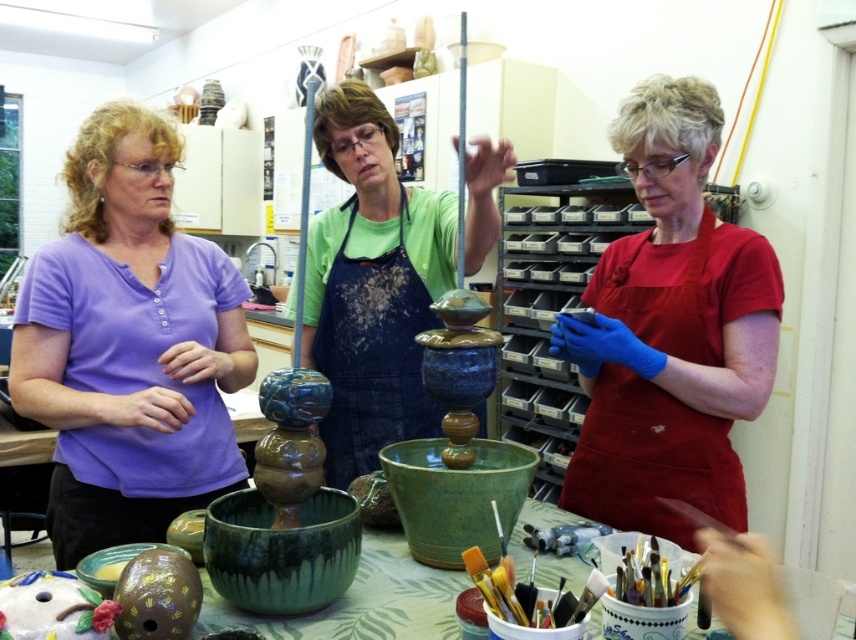
Question: Is purple cotton shirt at left above blue glossy vase at center?

Choices:
 (A) no
 (B) yes

Answer: (A)

Question: Which object is farther from the camera taking this photo?

Choices:
 (A) blue denim apron at center
 (B) purple cotton shirt at left
 (C) red matte apron at center
 (D) blue glossy vase at center

Answer: (A)

Question: Where is purple cotton shirt at left located in relation to blue glossy vase at center in the image?

Choices:
 (A) left
 (B) right

Answer: (A)

Question: Which point appears farthest from the camera in this image?

Choices:
 (A) (437, 323)
 (B) (450, 220)
 (C) (643, 440)

Answer: (A)

Question: Which of these objects is positioned farthest from the blue glossy vase at center?

Choices:
 (A) purple cotton shirt at left
 (B) blue denim apron at center
 (C) red matte apron at center

Answer: (C)

Question: Does purple cotton shirt at left have a smaller size compared to blue denim apron at center?

Choices:
 (A) yes
 (B) no

Answer: (B)